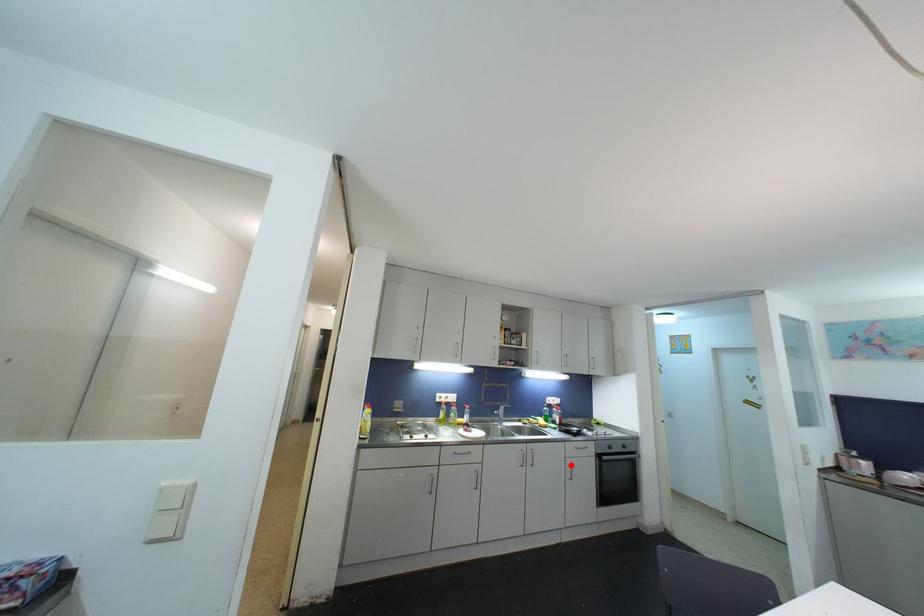
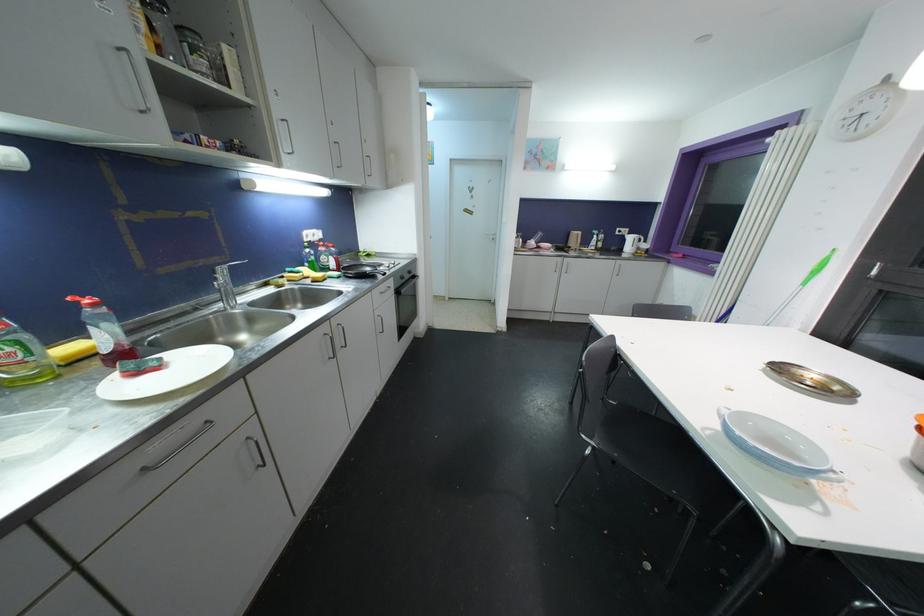
In the second image, find the point that corresponds to the highlighted location in the first image.

(379, 318)